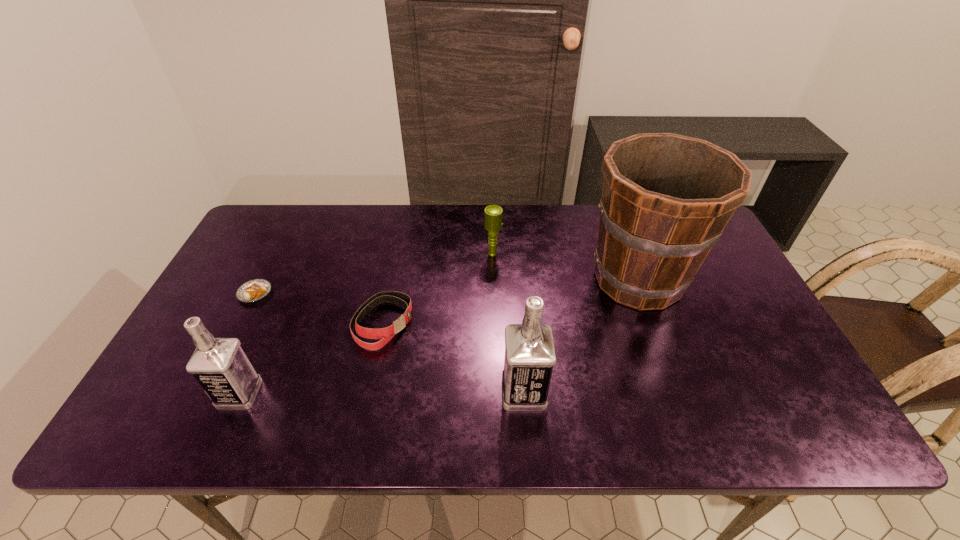
You are a GUI agent. You are given a task and a screenshot of the screen. Output one action in this format:
    pyautogui.click(x=<x>, y=<y>)
    Task: Click on the third tallest object
    This screenshot has width=960, height=540.
    Given the screenshot: What is the action you would take?
    pyautogui.click(x=220, y=366)

Identify the location of the left vodka. (220, 366).

This screenshot has height=540, width=960. What are the coordinates of `the second tallest object` in the screenshot? It's located at (530, 356).

You are a GUI agent. You are given a task and a screenshot of the screen. Output one action in this format:
    pyautogui.click(x=<x>, y=<y>)
    Task: Click on the taller vodka
    This screenshot has height=540, width=960.
    Given the screenshot: What is the action you would take?
    pyautogui.click(x=530, y=356)

At what (x,y) coordinates should I click in order to perform the action: click on microphone. Please return your answer as a coordinate pair (x, y). The image size is (960, 540). Looking at the image, I should click on (493, 214).

The height and width of the screenshot is (540, 960). What are the coordinates of `the fourth object from right to left` in the screenshot? It's located at (385, 334).

Where is `the second shortest object`? This screenshot has height=540, width=960. the second shortest object is located at coordinates (385, 334).

The height and width of the screenshot is (540, 960). In order to click on the shortest object in this screenshot , I will do `click(254, 290)`.

At what (x,y) coordinates should I click in order to perform the action: click on bucket. Please return your answer as a coordinate pair (x, y). Looking at the image, I should click on (666, 198).

The width and height of the screenshot is (960, 540). I want to click on the tallest object, so click(x=666, y=198).